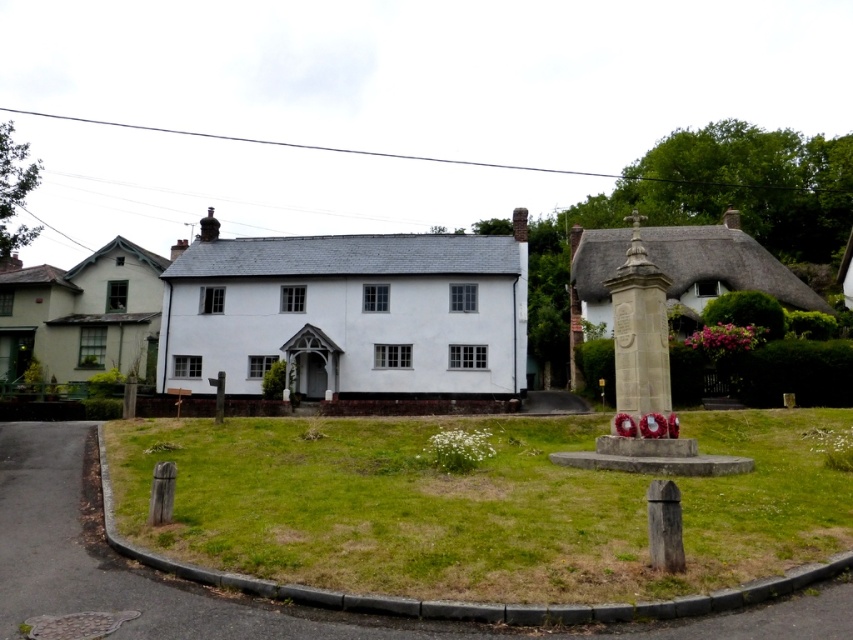
You are standing at the center of the image and want to walk towards the matte white cottage at left. In which direction should you head?

Since the matte white cottage at left is located at point 0.484 on the x and 0.034 on the y coordinates, you should head to the left direction to reach it.

You are a photographer setting up equipment in the scene. You need to place a large tripod between the matte white cottage at left and the wooden post at lower left. Considering their sizes, which object should you position closer to the tripod to ensure stability?

The matte white cottage at left is bigger than the wooden post at lower left, so positioning the tripod closer to the larger matte white cottage at left would provide better stability due to its size and weight.